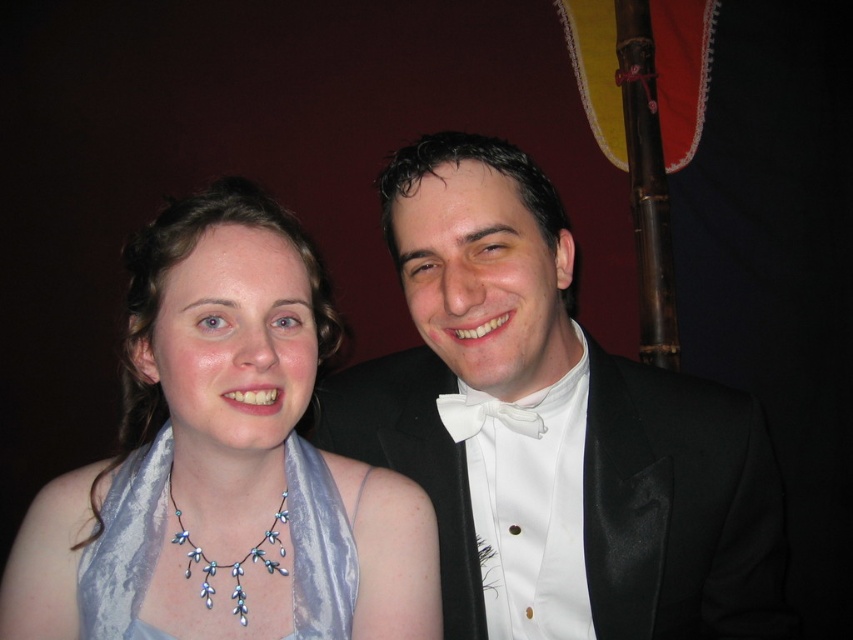
You are a photographer adjusting the lighting for a portrait. You notice the black satin tuxedo at center and the shiny silver necklace at center. Which object should you focus on to avoid glare since it is positioned higher?

The black satin tuxedo at center is above the shiny silver necklace at center, so you should focus on the black satin tuxedo at center to avoid glare since higher positioned objects may reflect more light.

You are standing in front of the photograph and want to describe the position of the black satin tuxedo at center. Where exactly is it located in the image?

The black satin tuxedo at center is located at point coordinates of 0.662 on the x axis and 0.652 on the y axis.

You are a photographer setting up for a closeup shot focusing on the shiny silver necklace at center and the white satin bow tie at center. Which of the two items should you adjust your focus to capture more clearly if your camera has a limited depth of field?

The shiny silver necklace at center has a greater height compared to the white satin bow tie at center, so adjusting focus on the shiny silver necklace at center would ensure it appears clearer due to its larger size in the frame.